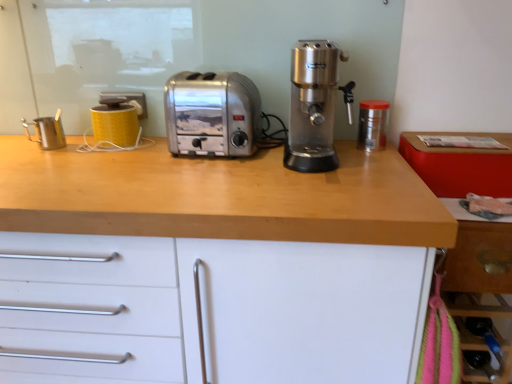
Locate an element on the screen. This screenshot has height=384, width=512. free point in front of transparent plastic container at right, arranged as the 3th kitchen appliance when viewed from the left is located at coordinates (367, 157).